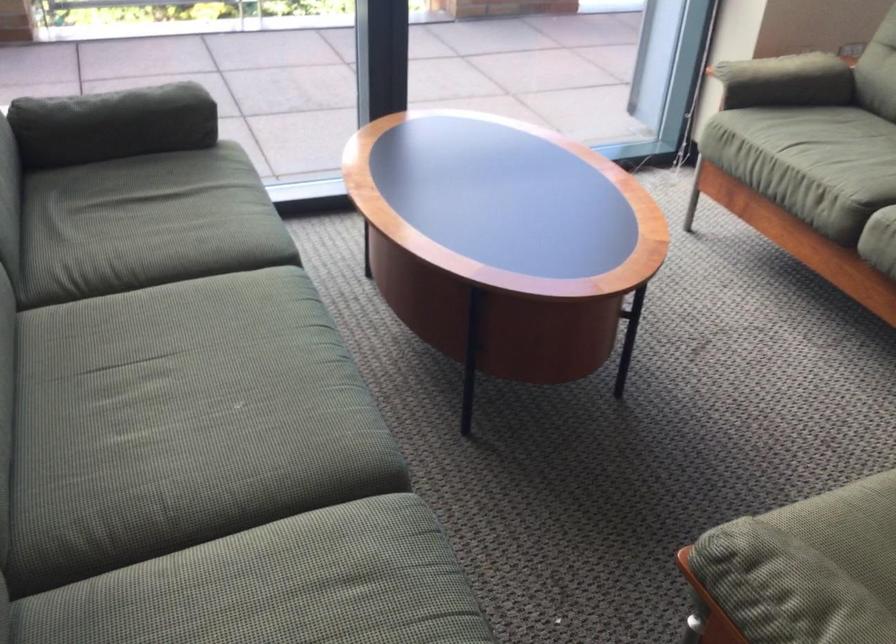
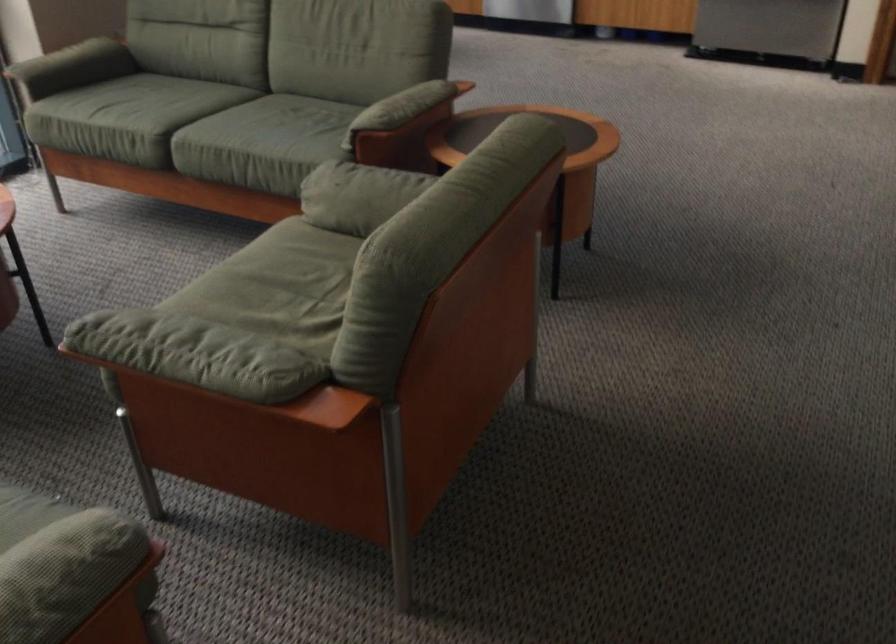
The point at (787, 144) is marked in the first image. Where is the corresponding point in the second image?

(97, 108)